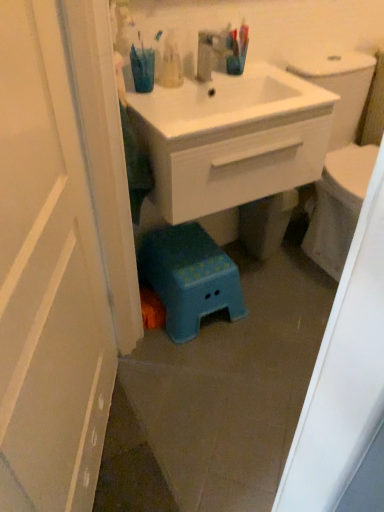
Question: Considering the relative positions of white glossy door at left and blue plastic step stool at lower center in the image provided, is white glossy door at left to the left or to the right of blue plastic step stool at lower center?

Choices:
 (A) right
 (B) left

Answer: (B)

Question: Looking at their shapes, would you say white glossy door at left is wider or thinner than blue plastic step stool at lower center?

Choices:
 (A) thin
 (B) wide

Answer: (A)

Question: Estimate the real-world distances between objects in this image. Which object is closer to the teal plastic cup at upper center?

Choices:
 (A) white glossy door at left
 (B) blue plastic step stool at lower center
 (C) white glossy sink at center
 (D) translucent plastic toothbrushes at upper center

Answer: (D)

Question: Which is farther from the blue plastic step stool at lower center?

Choices:
 (A) white glossy door at left
 (B) translucent plastic toothbrushes at upper center
 (C) white glossy sink at center
 (D) teal plastic cup at upper center

Answer: (A)